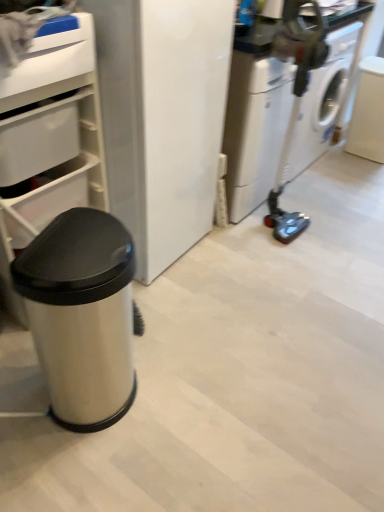
Question: Is white plastic drawer at upper left, positioned as the first drawer in top-to-bottom order, positioned far away from satin silver trash can at left?

Choices:
 (A) yes
 (B) no

Answer: (B)

Question: Does white plastic drawer at upper left, positioned as the first drawer in top-to-bottom order, have a greater width compared to satin silver trash can at left?

Choices:
 (A) yes
 (B) no

Answer: (A)

Question: Can you confirm if white plastic drawer at upper left, positioned as the first drawer in top-to-bottom order, is thinner than satin silver trash can at left?

Choices:
 (A) yes
 (B) no

Answer: (B)

Question: Is white plastic drawer at upper left, positioned as the first drawer in top-to-bottom order, facing towards satin silver trash can at left?

Choices:
 (A) yes
 (B) no

Answer: (B)

Question: From the image's perspective, would you say white plastic drawer at upper left, positioned as the first drawer in top-to-bottom order, is shown under satin silver trash can at left?

Choices:
 (A) no
 (B) yes

Answer: (A)

Question: Considering the relative positions of white plastic drawer at upper left, the second drawer from the bottom, and satin silver trash can at left in the image provided, is white plastic drawer at upper left, the second drawer from the bottom, to the right of satin silver trash can at left from the viewer's perspective?

Choices:
 (A) yes
 (B) no

Answer: (B)

Question: Considering the relative sizes of white glossy washing machine at right and white plastic drawer at upper left, which is the first drawer from bottom to top, in the image provided, is white glossy washing machine at right wider than white plastic drawer at upper left, which is the first drawer from bottom to top,?

Choices:
 (A) no
 (B) yes

Answer: (A)

Question: Can you confirm if white glossy washing machine at right is shorter than white plastic drawer at upper left, which is the first drawer from bottom to top?

Choices:
 (A) yes
 (B) no

Answer: (B)

Question: Does white glossy washing machine at right lie in front of white plastic drawer at upper left, which is the first drawer from bottom to top?

Choices:
 (A) yes
 (B) no

Answer: (B)

Question: Would you say white plastic drawer at upper left, which is the first drawer from bottom to top, is part of white glossy washing machine at right's contents?

Choices:
 (A) yes
 (B) no

Answer: (B)

Question: Does white glossy washing machine at right have a greater height compared to white plastic drawer at upper left, which is counted as the second drawer, starting from the top?

Choices:
 (A) yes
 (B) no

Answer: (A)

Question: Is white glossy washing machine at right aimed at white plastic drawer at upper left, which is the first drawer from bottom to top?

Choices:
 (A) yes
 (B) no

Answer: (B)

Question: From the image's perspective, is white plastic drawer at upper left, the second drawer from the bottom, located beneath white glossy washing machine at right?

Choices:
 (A) yes
 (B) no

Answer: (A)